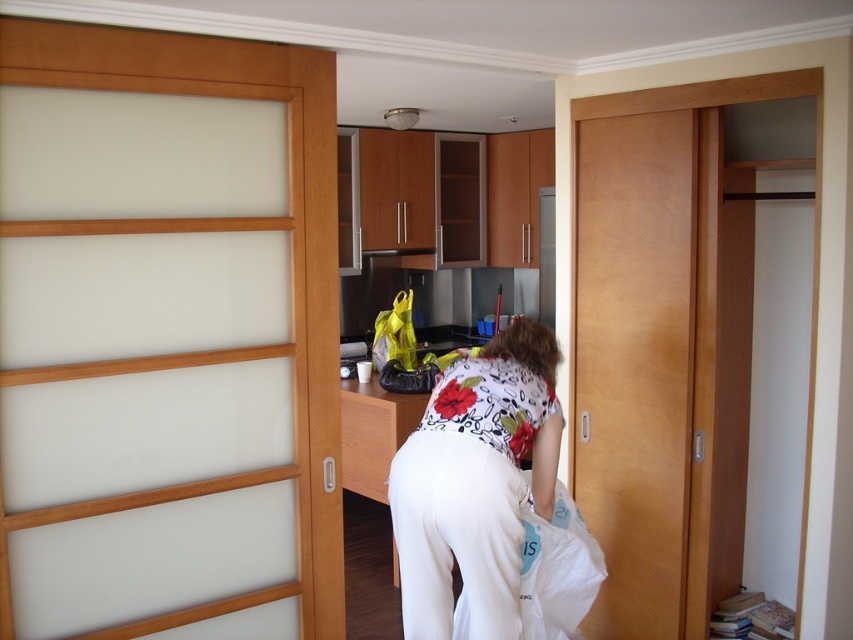
You are standing in the living room and see the beech wood door at right and the white floral shirt at center through the kitchen doorway. Which object is taller?

The beech wood door at right is much taller than the white floral shirt at center.

You are standing in the living room and see the kitchen through the open wooden sliding doors on the left. There is a point marked at coordinates (634, 362). What object does this point correspond to?

The point at coordinates (634, 362) corresponds to the beech wood door at right.